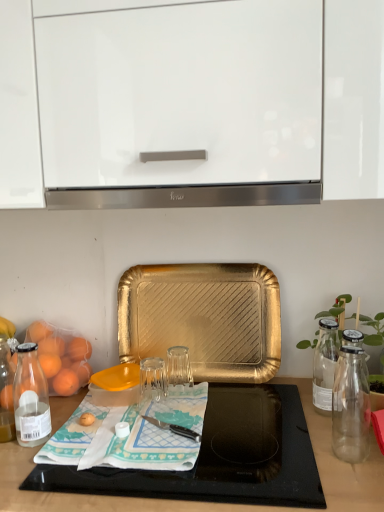
This screenshot has width=384, height=512. Describe the element at coordinates (374, 332) in the screenshot. I see `green glass bottle at right` at that location.

This screenshot has width=384, height=512. What do you see at coordinates (116, 385) in the screenshot?
I see `transparent glass at center` at bounding box center [116, 385].

Find the location of a particular element. green glass bottle at right is located at coordinates (374, 332).

Considering the sizes of objects glossy white cabinet at upper center and transparent glass at center in the image provided, who is wider, glossy white cabinet at upper center or transparent glass at center?

glossy white cabinet at upper center.

Looking at the image, does glossy white cabinet at upper center seem bigger or smaller compared to transparent glass at center?

glossy white cabinet at upper center is bigger than transparent glass at center.

Would you say glossy white cabinet at upper center is a long distance from transparent glass at center?

No, glossy white cabinet at upper center is not far away from transparent glass at center.

From a real-world perspective, is transparent glass at center positioned under transparent glass at center based on gravity?

No.

Is point (159, 375) more distant than point (105, 380)?

Yes, it is.

Would you consider transparent glass at center to be distant from transparent glass at center?

No, transparent glass at center is not far from transparent glass at center.

Does transparent glass at center turn towards transparent glass at center?

No, transparent glass at center is not facing towards transparent glass at center.

In terms of width, does translucent glass bottle at left look wider or thinner when compared to transparent plastic cutting board at lower center?

Considering their sizes, translucent glass bottle at left looks slimmer than transparent plastic cutting board at lower center.

How far apart are translucent glass bottle at left and transparent plastic cutting board at lower center?

translucent glass bottle at left and transparent plastic cutting board at lower center are 14.89 inches apart.

Does translucent glass bottle at left turn towards transparent plastic cutting board at lower center?

No.

Does translucent glass bottle at left touch transparent plastic cutting board at lower center?

translucent glass bottle at left is not next to transparent plastic cutting board at lower center, and they're not touching.

Which object is closer to the camera taking this photo, translucent glass bottle at left or transparent glass at center?

translucent glass bottle at left is more forward.

Is transparent glass at center completely or partially inside translucent glass bottle at left?

No, translucent glass bottle at left does not contain transparent glass at center.

From the picture: Is translucent glass bottle at left facing away from transparent glass at center?

translucent glass bottle at left does not have its back to transparent glass at center.

Identify the location of glass jar that appears behind the translucent glass bottle at left. This screenshot has height=512, width=384. (152, 379).

Is the position of satin silver exhaust hood at center more distant than that of transparent glass at center?

That is False.

Which object is positioned more to the left, satin silver exhaust hood at center or transparent glass at center?

transparent glass at center is more to the left.

Which point is more forward, (316, 198) or (130, 403)?

Point (316, 198)

Is teal fabric placemat at center aimed at gold textured tray at center?

No, teal fabric placemat at center is not facing towards gold textured tray at center.

From the image's perspective, relative to gold textured tray at center, is teal fabric placemat at center above or below?

From the image's perspective, teal fabric placemat at center appears below gold textured tray at center.

Can you confirm if teal fabric placemat at center is smaller than gold textured tray at center?

Yes, teal fabric placemat at center is smaller than gold textured tray at center.

Is teal fabric placemat at center taller than gold textured tray at center?

No, teal fabric placemat at center is not taller than gold textured tray at center.

How many degrees apart are the facing directions of teal fabric placemat at center and transparent plastic cutting board at lower center?

There is a 1.21-degree angle between the facing directions of teal fabric placemat at center and transparent plastic cutting board at lower center.

Who is taller, teal fabric placemat at center or transparent plastic cutting board at lower center?

Standing taller between the two is transparent plastic cutting board at lower center.

This screenshot has height=512, width=384. Find the location of `cutting board below the teal fabric placemat at center (from a real-world perspective)`. cutting board below the teal fabric placemat at center (from a real-world perspective) is located at coordinates (220, 457).

Which is closer, [155,451] or [225,411]?

Point [155,451] is positioned closer to the camera compared to point [225,411].

The height and width of the screenshot is (512, 384). What are the coordinates of `glass jar to the left of glossy white cabinet at upper center` in the screenshot? It's located at (152, 379).

Where is `glass jar lying on the right of transparent glass at center`? glass jar lying on the right of transparent glass at center is located at coordinates point(152,379).

Which object lies nearer to the anchor point transparent glass at center, green glass bottle at right or transparent glass at center?

transparent glass at center lies closer to transparent glass at center than the other object.

Looking at this image, when comparing their distances from green glass bottle at right, does transparent plastic cutting board at lower center or transparent glass at center seem further?

transparent glass at center is further to green glass bottle at right.

When comparing their distances from glossy white cabinet at upper center, does green glass bottle at right or transparent glass at center seem further?

The object further to glossy white cabinet at upper center is transparent glass at center.

Which object lies nearer to the anchor point green glass bottle at right, transparent glass at center or gold textured tray at center?

gold textured tray at center lies closer to green glass bottle at right than the other object.

From the image, which object appears to be nearer to glossy white cabinet at upper center, transparent glass at center or teal fabric placemat at center?

teal fabric placemat at center is closer to glossy white cabinet at upper center.

Looking at the image, which one is located closer to gold textured tray at center, glossy white cabinet at upper center or transparent glass at center?

The object closer to gold textured tray at center is transparent glass at center.

Looking at the image, which one is located closer to satin silver exhaust hood at center, glossy white cabinet at upper center or transparent glass at center?

glossy white cabinet at upper center is closer to satin silver exhaust hood at center.

From the image, which object appears to be farther from transparent glass at center, green glass bottle at right or translucent glass bottle at left?

Among the two, green glass bottle at right is located further to transparent glass at center.

Identify the location of glass jar between translucent glass bottle at left and green glass bottle at right. (152, 379).

What are the coordinates of `plant that lies between glossy white cabinet at upper center and transparent glass at center from top to bottom` in the screenshot? It's located at (374, 332).

Locate an element on the screen. The height and width of the screenshot is (512, 384). appliance between translucent glass bottle at left and transparent glass at center is located at coordinates (116, 385).

You are a GUI agent. You are given a task and a screenshot of the screen. Output one action in this format:
    pyautogui.click(x=<x>, y=<y>)
    Task: Click on the appliance situated between translucent glass bottle at left and transparent plastic cutting board at lower center from left to right
    Image resolution: width=384 pixels, height=512 pixels.
    Given the screenshot: What is the action you would take?
    pyautogui.click(x=116, y=385)